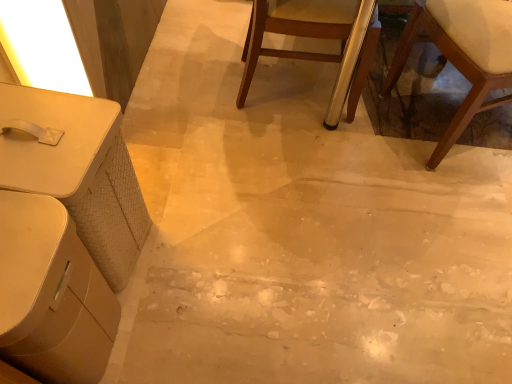
Question: Considering the positions of wooden chair with white cushion at lower right, which is counted as the second chair, starting from the left, and white glossy table at lower left, arranged as the first table when ordered from the bottom, in the image, is wooden chair with white cushion at lower right, which is counted as the second chair, starting from the left, taller or shorter than white glossy table at lower left, arranged as the first table when ordered from the bottom,?

Choices:
 (A) tall
 (B) short

Answer: (A)

Question: Is wooden chair with white cushion at lower right, positioned as the first chair in right-to-left order, wider or thinner than white glossy table at lower left, arranged as the first table when ordered from the bottom?

Choices:
 (A) thin
 (B) wide

Answer: (B)

Question: Which of these objects is positioned farthest from the white glossy table at lower left, the second table positioned from the top?

Choices:
 (A) wooden chair with white cushion at lower right, positioned as the first chair in right-to-left order
 (B) white matte table at left, the second table positioned from the bottom
 (C) wooden chair at center, the 2th chair when ordered from right to left

Answer: (A)

Question: Which is nearer to the white matte table at left, which is counted as the 1th table, starting from the top?

Choices:
 (A) white glossy table at lower left, the second table positioned from the top
 (B) wooden chair with white cushion at lower right, positioned as the first chair in right-to-left order
 (C) wooden chair at center, the 2th chair when ordered from right to left

Answer: (A)